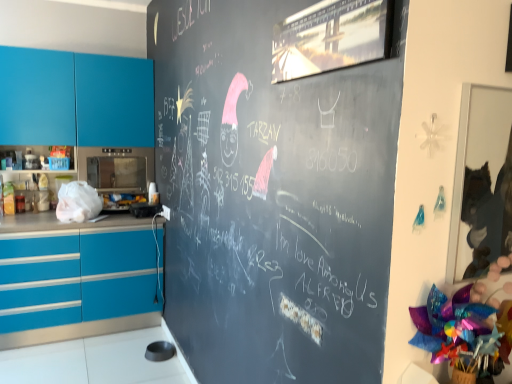
Question: Considering the relative positions of metallic microwave at center-left, marked as the second appliance in a top-to-bottom arrangement, and teal glossy cabinets at left in the image provided, is metallic microwave at center-left, marked as the second appliance in a top-to-bottom arrangement, to the right of teal glossy cabinets at left from the viewer's perspective?

Choices:
 (A) no
 (B) yes

Answer: (B)

Question: Is metallic microwave at center-left, marked as the first appliance in a bottom-to-top arrangement, positioned beyond the bounds of teal glossy cabinets at left?

Choices:
 (A) yes
 (B) no

Answer: (A)

Question: Is metallic microwave at center-left, marked as the first appliance in a bottom-to-top arrangement, facing away from teal glossy cabinets at left?

Choices:
 (A) yes
 (B) no

Answer: (B)

Question: From a real-world perspective, is metallic microwave at center-left, marked as the first appliance in a bottom-to-top arrangement, under teal glossy cabinets at left?

Choices:
 (A) no
 (B) yes

Answer: (B)

Question: Is metallic microwave at center-left, marked as the first appliance in a bottom-to-top arrangement, with teal glossy cabinets at left?

Choices:
 (A) no
 (B) yes

Answer: (A)

Question: Would you say satin silver microwave at left, the second appliance ordered from the bottom, is to the left or to the right of teal glossy cabinets at left in the picture?

Choices:
 (A) left
 (B) right

Answer: (B)

Question: From a real-world perspective, relative to teal glossy cabinets at left, is satin silver microwave at left, which ranks as the 1th appliance in top-to-bottom order, vertically above or below?

Choices:
 (A) below
 (B) above

Answer: (A)

Question: Is satin silver microwave at left, the second appliance ordered from the bottom, wider or thinner than teal glossy cabinets at left?

Choices:
 (A) wide
 (B) thin

Answer: (A)

Question: Do you think satin silver microwave at left, which ranks as the 1th appliance in top-to-bottom order, is within teal glossy cabinets at left, or outside of it?

Choices:
 (A) outside
 (B) inside

Answer: (B)

Question: Is metallic microwave at center-left, marked as the first appliance in a bottom-to-top arrangement, inside or outside of teal glossy cabinets at left?

Choices:
 (A) outside
 (B) inside

Answer: (A)

Question: Would you say metallic microwave at center-left, marked as the first appliance in a bottom-to-top arrangement, is to the left or to the right of teal glossy cabinets at left in the picture?

Choices:
 (A) right
 (B) left

Answer: (A)

Question: Considering the positions of metallic microwave at center-left, marked as the second appliance in a top-to-bottom arrangement, and teal glossy cabinets at left in the image, is metallic microwave at center-left, marked as the second appliance in a top-to-bottom arrangement, bigger or smaller than teal glossy cabinets at left?

Choices:
 (A) small
 (B) big

Answer: (A)

Question: Is metallic microwave at center-left, marked as the second appliance in a top-to-bottom arrangement, wider or thinner than teal glossy cabinets at left?

Choices:
 (A) thin
 (B) wide

Answer: (A)

Question: From a real-world perspective, relative to satin silver microwave at left, the second appliance ordered from the bottom, is teal glossy cabinets at left vertically above or below?

Choices:
 (A) below
 (B) above

Answer: (B)

Question: Visually, is teal glossy cabinets at left positioned to the left or to the right of satin silver microwave at left, the second appliance ordered from the bottom?

Choices:
 (A) left
 (B) right

Answer: (A)